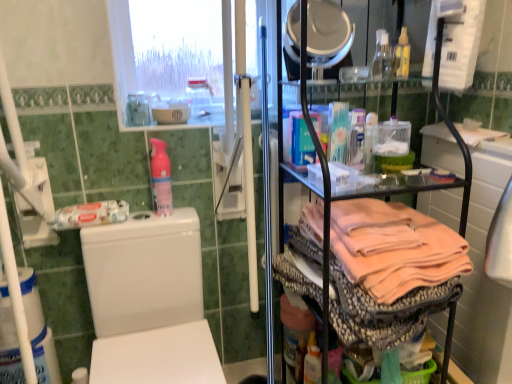
At what (x,y) coordinates should I click in order to perform the action: click on pink plastic spray bottle at upper center, the 4th bottle viewed from the right. Please return your answer as a coordinate pair (x, y). The image size is (512, 384). Looking at the image, I should click on (161, 178).

What do you see at coordinates (167, 51) in the screenshot? Image resolution: width=512 pixels, height=384 pixels. I see `white mesh screen at upper center` at bounding box center [167, 51].

How much space does yellow translucent spray bottle at upper right, which appears as the 5th bottle when viewed from the left, occupy horizontally?

yellow translucent spray bottle at upper right, which appears as the 5th bottle when viewed from the left, is 2.37 inches in width.

Identify the location of yellow translucent spray bottle at upper right, acting as the first bottle starting from the right. (402, 55).

The width and height of the screenshot is (512, 384). Describe the element at coordinates (149, 301) in the screenshot. I see `white glossy toilet at left` at that location.

At what (x,y) coordinates should I click in order to perform the action: click on transparent glass bottle at upper right, which appears as the fourth bottle when viewed from the left. Please return your answer as a coordinate pair (x, y). This screenshot has height=384, width=512. Looking at the image, I should click on (382, 57).

Locate an element on the screen. The image size is (512, 384). pink plastic spray bottle at upper center, which is the second bottle from left to right is located at coordinates (161, 178).

Is white glossy mirror at upper center shorter than transparent plastic spray bottle at upper center, the 3th bottle viewed from the left?

→ No.

From a real-world perspective, is white glossy mirror at upper center physically located above or below transparent plastic spray bottle at upper center, the 3th bottle viewed from the left?

white glossy mirror at upper center is situated higher than transparent plastic spray bottle at upper center, the 3th bottle viewed from the left, in the real world.

In the scene shown: Who is smaller, white glossy mirror at upper center or transparent plastic spray bottle at upper center, the third bottle in the right-to-left sequence?

With smaller size is transparent plastic spray bottle at upper center, the third bottle in the right-to-left sequence.

Between white glossy mirror at upper center and transparent plastic spray bottle at upper center, the third bottle in the right-to-left sequence, which one appears on the left side from the viewer's perspective?

Positioned to the left is transparent plastic spray bottle at upper center, the third bottle in the right-to-left sequence.

Looking at this image, is yellow translucent spray bottle at upper right, which appears as the 5th bottle when viewed from the left, completely or partially outside of white glossy mirror at upper center?

Yes, yellow translucent spray bottle at upper right, which appears as the 5th bottle when viewed from the left, is not within white glossy mirror at upper center.

Is yellow translucent spray bottle at upper right, which appears as the 5th bottle when viewed from the left, taller than white glossy mirror at upper center?

In fact, yellow translucent spray bottle at upper right, which appears as the 5th bottle when viewed from the left, may be shorter than white glossy mirror at upper center.

At what (x,y) coordinates should I click in order to perform the action: click on the 2nd bottle to the right of the white glossy mirror at upper center, starting your count from the anchor. Please return your answer as a coordinate pair (x, y). This screenshot has height=384, width=512. Looking at the image, I should click on (402, 55).

From a real-world perspective, which is physically below, yellow translucent spray bottle at upper right, which appears as the 5th bottle when viewed from the left, or white glossy mirror at upper center?

From a 3D spatial view, yellow translucent spray bottle at upper right, which appears as the 5th bottle when viewed from the left, is below.

Is point (161, 215) positioned in front of point (190, 94)?

That is True.

Who is shorter, pink plastic spray bottle at upper center, which is the second bottle from left to right, or transparent plastic spray bottle at upper center, the 3th bottle viewed from the left?

transparent plastic spray bottle at upper center, the 3th bottle viewed from the left.

From a real-world perspective, which object rests below the other?

pink plastic spray bottle at upper center, the 4th bottle viewed from the right, from a real-world perspective.

Starting from the pink plastic spray bottle at upper center, the 4th bottle viewed from the right, which bottle is the 2nd one behind? Please provide its 2D coordinates.

[(199, 96)]

Which object is wider, transparent glass bottle at upper center, which appears as the 5th bottle when viewed from the right, or pink plastic spray bottle at upper center, the 4th bottle viewed from the right?

transparent glass bottle at upper center, which appears as the 5th bottle when viewed from the right.

From a real-world perspective, is transparent glass bottle at upper center, which appears as the 5th bottle when viewed from the right, under pink plastic spray bottle at upper center, the 4th bottle viewed from the right?

No, from a real-world perspective, transparent glass bottle at upper center, which appears as the 5th bottle when viewed from the right, is not beneath pink plastic spray bottle at upper center, the 4th bottle viewed from the right.

Image resolution: width=512 pixels, height=384 pixels. I want to click on bottle located below the transparent glass bottle at upper center, which appears as the 5th bottle when viewed from the right (from the image's perspective), so click(x=161, y=178).

From the picture: Is transparent plastic spray bottle at upper center, the 3th bottle viewed from the left, turned away from white glossy mirror at upper center?

No, white glossy mirror at upper center is not at the back of transparent plastic spray bottle at upper center, the 3th bottle viewed from the left.

Is transparent plastic spray bottle at upper center, the 3th bottle viewed from the left, completely or partially outside of white glossy mirror at upper center?

Absolutely, transparent plastic spray bottle at upper center, the 3th bottle viewed from the left, is external to white glossy mirror at upper center.

Is transparent plastic spray bottle at upper center, the 3th bottle viewed from the left, bigger or smaller than white glossy mirror at upper center?

In the image, transparent plastic spray bottle at upper center, the 3th bottle viewed from the left, appears to be smaller than white glossy mirror at upper center.

Identify the location of bowl below the yellow translucent spray bottle at upper right, which appears as the 5th bottle when viewed from the left (from a real-world perspective). Image resolution: width=512 pixels, height=384 pixels. (170, 115).

From the image's perspective, which one is positioned lower, white glossy bowl at upper center or yellow translucent spray bottle at upper right, which appears as the 5th bottle when viewed from the left?

white glossy bowl at upper center appears lower in the image.

From a real-world perspective, is white glossy bowl at upper center above or below yellow translucent spray bottle at upper right, which appears as the 5th bottle when viewed from the left?

In terms of real-world spatial position, white glossy bowl at upper center is below yellow translucent spray bottle at upper right, which appears as the 5th bottle when viewed from the left.

Between point (204, 80) and point (140, 102), which one is positioned behind?

The point (204, 80) is behind.

From the image's perspective, is transparent plastic spray bottle at upper center, the third bottle in the right-to-left sequence, located beneath transparent glass bottle at upper center, which is the 1th bottle in left-to-right order?

Actually, transparent plastic spray bottle at upper center, the third bottle in the right-to-left sequence, appears above transparent glass bottle at upper center, which is the 1th bottle in left-to-right order, in the image.

Can you tell me how much transparent plastic spray bottle at upper center, the 3th bottle viewed from the left, and transparent glass bottle at upper center, which is the 1th bottle in left-to-right order, differ in facing direction?

transparent plastic spray bottle at upper center, the 3th bottle viewed from the left, and transparent glass bottle at upper center, which is the 1th bottle in left-to-right order, are facing 4.98 degrees away from each other.

Locate an element on the screen. Image resolution: width=512 pixels, height=384 pixels. the 3rd bottle positioned below the white glossy mirror at upper center (from a real-world perspective) is located at coordinates (199, 96).

There is a white glossy mirror at upper center. Find the location of `the 1st bottle above it (from the image's perspective)`. the 1st bottle above it (from the image's perspective) is located at coordinates (402, 55).

Looking at the image, which one is located closer to transparent plastic spray bottle at upper center, the 3th bottle viewed from the left, transparent glass bottle at upper center, which appears as the 5th bottle when viewed from the right, or white glossy mirror at upper center?

transparent glass bottle at upper center, which appears as the 5th bottle when viewed from the right, lies closer to transparent plastic spray bottle at upper center, the 3th bottle viewed from the left, than the other object.

Which object lies nearer to the anchor point white glossy mirror at upper center, white glossy toilet at left or transparent glass bottle at upper right, marked as the 2th bottle in a right-to-left arrangement?

Among the two, transparent glass bottle at upper right, marked as the 2th bottle in a right-to-left arrangement, is located nearer to white glossy mirror at upper center.

When comparing their distances from yellow translucent spray bottle at upper right, which appears as the 5th bottle when viewed from the left, does white glossy toilet at left or transparent glass bottle at upper center, which appears as the 5th bottle when viewed from the right, seem closer?

transparent glass bottle at upper center, which appears as the 5th bottle when viewed from the right.

When comparing their distances from white mesh screen at upper center, does white glossy mirror at upper center or transparent plastic spray bottle at upper center, the third bottle in the right-to-left sequence, seem further?

The object further to white mesh screen at upper center is white glossy mirror at upper center.

Estimate the real-world distances between objects in this image. Which object is further from pink plastic spray bottle at upper center, which is the second bottle from left to right, transparent glass bottle at upper right, which appears as the fourth bottle when viewed from the left, or transparent glass bottle at upper center, which is the 1th bottle in left-to-right order?

Based on the image, transparent glass bottle at upper right, which appears as the fourth bottle when viewed from the left, appears to be further to pink plastic spray bottle at upper center, which is the second bottle from left to right.

From the image, which object appears to be nearer to transparent plastic spray bottle at upper center, the third bottle in the right-to-left sequence, white glossy mirror at upper center or yellow translucent spray bottle at upper right, which appears as the 5th bottle when viewed from the left?

white glossy mirror at upper center lies closer to transparent plastic spray bottle at upper center, the third bottle in the right-to-left sequence, than the other object.

Estimate the real-world distances between objects in this image. Which object is further from transparent glass bottle at upper right, which appears as the fourth bottle when viewed from the left, yellow translucent spray bottle at upper right, acting as the first bottle starting from the right, or transparent glass bottle at upper center, which is the 1th bottle in left-to-right order?

transparent glass bottle at upper center, which is the 1th bottle in left-to-right order.

Based on their spatial positions, is yellow translucent spray bottle at upper right, acting as the first bottle starting from the right, or white glossy bowl at upper center further from pink plastic spray bottle at upper center, the 4th bottle viewed from the right?

yellow translucent spray bottle at upper right, acting as the first bottle starting from the right, lies further to pink plastic spray bottle at upper center, the 4th bottle viewed from the right, than the other object.

The width and height of the screenshot is (512, 384). I want to click on mirror between yellow translucent spray bottle at upper right, acting as the first bottle starting from the right, and white glossy toilet at left vertically, so click(x=328, y=37).

What are the coordinates of `bowl between transparent glass bottle at upper center, which appears as the 5th bottle when viewed from the right, and yellow translucent spray bottle at upper right, acting as the first bottle starting from the right, in the horizontal direction` in the screenshot? It's located at (170, 115).

Identify the location of window screen between white glossy bowl at upper center and white glossy mirror at upper center in the horizontal direction. The image size is (512, 384). click(x=167, y=51).

The image size is (512, 384). Identify the location of mirror situated between transparent plastic spray bottle at upper center, the 3th bottle viewed from the left, and transparent glass bottle at upper right, which appears as the fourth bottle when viewed from the left, from left to right. (328, 37).